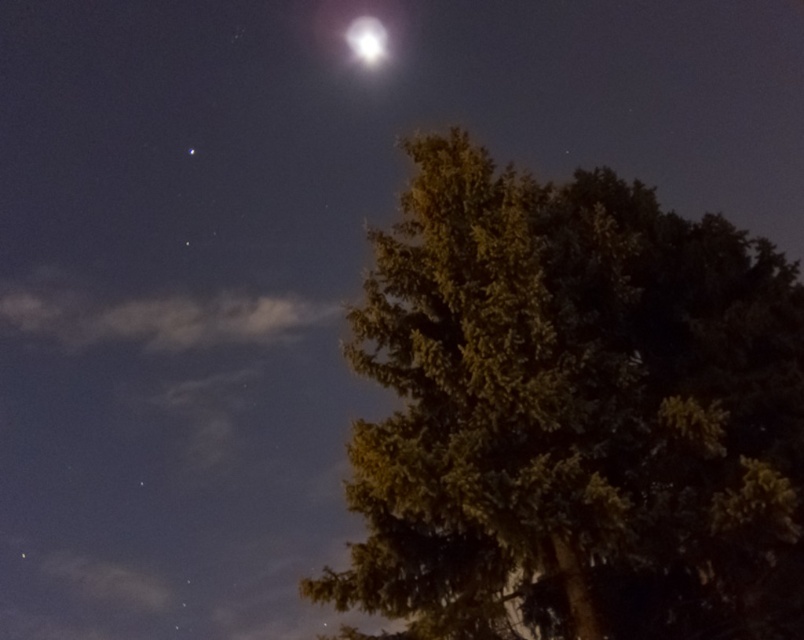
Question: Does green textured tree at right have a greater width compared to bright white crystal at upper center?

Choices:
 (A) no
 (B) yes

Answer: (B)

Question: Among these objects, which one is nearest to the camera?

Choices:
 (A) green textured tree at right
 (B) bright white crystal at upper center

Answer: (A)

Question: Which object is farther from the camera taking this photo?

Choices:
 (A) green textured tree at right
 (B) bright white crystal at upper center

Answer: (B)

Question: Does green textured tree at right have a larger size compared to bright white crystal at upper center?

Choices:
 (A) no
 (B) yes

Answer: (B)

Question: Does green textured tree at right have a smaller size compared to bright white crystal at upper center?

Choices:
 (A) no
 (B) yes

Answer: (A)